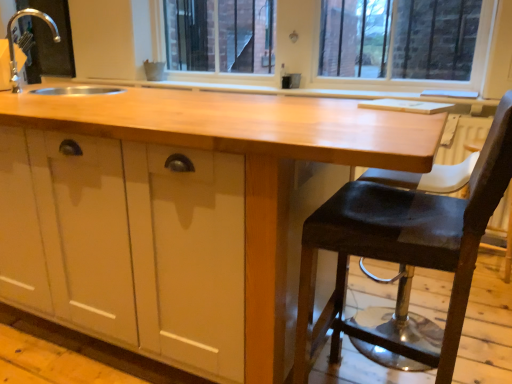
The image size is (512, 384). In order to click on glossy wood countertop at center in this screenshot , I will do `click(248, 166)`.

What do you see at coordinates (403, 251) in the screenshot? This screenshot has height=384, width=512. I see `dark brown leather stool at right` at bounding box center [403, 251].

Locate an element on the screen. The width and height of the screenshot is (512, 384). silver metallic faucet at upper left is located at coordinates (13, 43).

What are the coordinates of `countertop that is under the silver metallic faucet at upper left (from a real-world perspective)` in the screenshot? It's located at (248, 166).

Considering the positions of objects glossy wood countertop at center and silver metallic faucet at upper left in the image provided, who is more to the right, glossy wood countertop at center or silver metallic faucet at upper left?

glossy wood countertop at center.

Is point (285, 250) closer to camera compared to point (14, 79)?

Yes, it is.

How different are the orientations of dark brown leather stool at right and silver metallic faucet at upper left in degrees?

The angular difference between dark brown leather stool at right and silver metallic faucet at upper left is 142 degrees.

Is dark brown leather stool at right beside silver metallic faucet at upper left?

No, dark brown leather stool at right is not next to silver metallic faucet at upper left.

Based on the photo, relative to silver metallic faucet at upper left, is dark brown leather stool at right in front or behind?

Clearly, dark brown leather stool at right is in front of silver metallic faucet at upper left.

Is dark brown leather stool at right turned away from silver metallic faucet at upper left?

dark brown leather stool at right is not turned away from silver metallic faucet at upper left.

How far apart are dark brown leather stool at right and glossy wood countertop at center?

dark brown leather stool at right is 15.38 inches away from glossy wood countertop at center.

Considering the positions of point (382, 214) and point (286, 167), is point (382, 214) closer or farther from the camera than point (286, 167)?

Point (382, 214) is farther from the camera than point (286, 167).

Based on the photo, is dark brown leather stool at right facing towards glossy wood countertop at center?

Yes, dark brown leather stool at right is oriented towards glossy wood countertop at center.

Is the surface of dark brown leather stool at right in direct contact with glossy wood countertop at center?

dark brown leather stool at right and glossy wood countertop at center are clearly separated.

Which is behind, silver metallic faucet at upper left or dark brown leather stool at right?

silver metallic faucet at upper left is further away from the camera.

Between silver metallic faucet at upper left and dark brown leather stool at right, which one appears on the right side from the viewer's perspective?

dark brown leather stool at right is more to the right.

Does silver metallic faucet at upper left have a smaller size compared to dark brown leather stool at right?

Yes, silver metallic faucet at upper left is smaller than dark brown leather stool at right.

Who is shorter, silver metallic faucet at upper left or dark brown leather stool at right?

With less height is silver metallic faucet at upper left.

Considering the sizes of silver metallic faucet at upper left and glossy wood countertop at center in the image, is silver metallic faucet at upper left taller or shorter than glossy wood countertop at center?

Considering their sizes, silver metallic faucet at upper left has less height than glossy wood countertop at center.

Looking at the image, does silver metallic faucet at upper left seem bigger or smaller compared to glossy wood countertop at center?

In the image, silver metallic faucet at upper left appears to be smaller than glossy wood countertop at center.

From the picture: Is silver metallic faucet at upper left positioned with its back to glossy wood countertop at center?

No.

In terms of width, does silver metallic faucet at upper left look wider or thinner when compared to glossy wood countertop at center?

silver metallic faucet at upper left is thinner than glossy wood countertop at center.

Would you say glossy wood countertop at center contains dark brown leather stool at right?

Yes, dark brown leather stool at right is inside glossy wood countertop at center.

Who is shorter, glossy wood countertop at center or dark brown leather stool at right?

glossy wood countertop at center.

Is glossy wood countertop at center facing away from dark brown leather stool at right?

glossy wood countertop at center does not have its back to dark brown leather stool at right.

This screenshot has height=384, width=512. In order to click on faucet behind the glossy wood countertop at center in this screenshot , I will do `click(13, 43)`.

Identify the location of chair in front of the silver metallic faucet at upper left. Image resolution: width=512 pixels, height=384 pixels. (403, 251).

Estimate the real-world distances between objects in this image. Which object is further from dark brown leather stool at right, glossy wood countertop at center or silver metallic faucet at upper left?

silver metallic faucet at upper left lies further to dark brown leather stool at right than the other object.

From the image, which object appears to be farther from silver metallic faucet at upper left, dark brown leather stool at right or glossy wood countertop at center?

dark brown leather stool at right.

Estimate the real-world distances between objects in this image. Which object is closer to silver metallic faucet at upper left, glossy wood countertop at center or dark brown leather stool at right?

glossy wood countertop at center is positioned closer to the anchor silver metallic faucet at upper left.

Looking at the image, which one is located closer to glossy wood countertop at center, silver metallic faucet at upper left or dark brown leather stool at right?

Based on the image, dark brown leather stool at right appears to be nearer to glossy wood countertop at center.

Estimate the real-world distances between objects in this image. Which object is closer to glossy wood countertop at center, dark brown leather stool at right or silver metallic faucet at upper left?

dark brown leather stool at right is closer to glossy wood countertop at center.

When comparing their distances from dark brown leather stool at right, does silver metallic faucet at upper left or glossy wood countertop at center seem closer?

Based on the image, glossy wood countertop at center appears to be nearer to dark brown leather stool at right.

Locate an element on the screen. The image size is (512, 384). countertop between silver metallic faucet at upper left and dark brown leather stool at right is located at coordinates (248, 166).